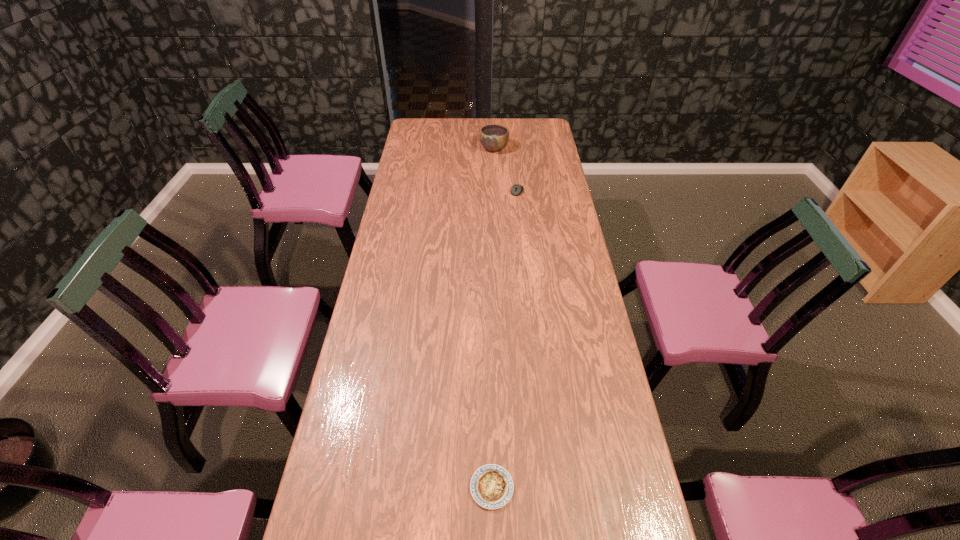
Where is `blank region between the second tallest object and the farthest object`? This screenshot has width=960, height=540. blank region between the second tallest object and the farthest object is located at coordinates tap(506, 170).

The width and height of the screenshot is (960, 540). In order to click on free space between the quiche and the second farthest object in this screenshot , I will do `click(505, 339)`.

At what (x,y) coordinates should I click in order to perform the action: click on object that is the closest to the farthest object. Please return your answer as a coordinate pair (x, y). This screenshot has width=960, height=540. Looking at the image, I should click on (517, 189).

Where is `the second closest object to the second farthest object`? The width and height of the screenshot is (960, 540). the second closest object to the second farthest object is located at coordinates (491, 486).

Locate an element on the screen. Image resolution: width=960 pixels, height=540 pixels. free space that satisfies the following two spatial constraints: 1. on the back side of the shortest object; 2. on the left side of the bowl is located at coordinates (486, 148).